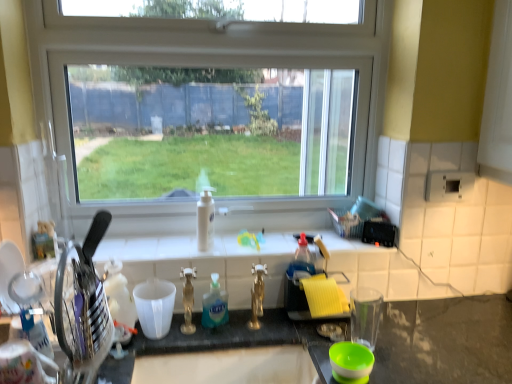
Identify the location of vacant region to the right of white glossy bottle at center, which appears as the first bottle when viewed from the top. The image size is (512, 384). (244, 247).